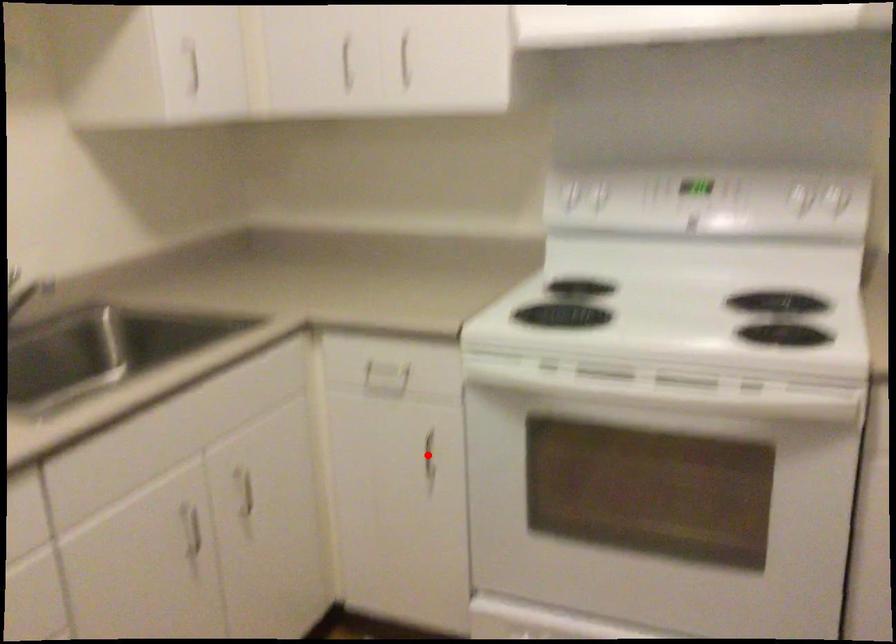
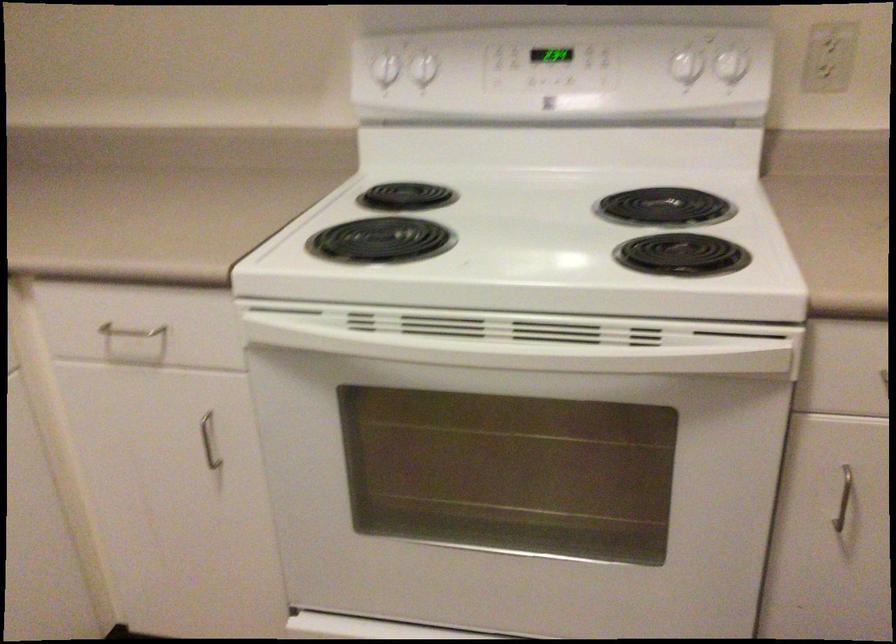
In the second image, find the point that corresponds to the highlighted location in the first image.

(209, 440)